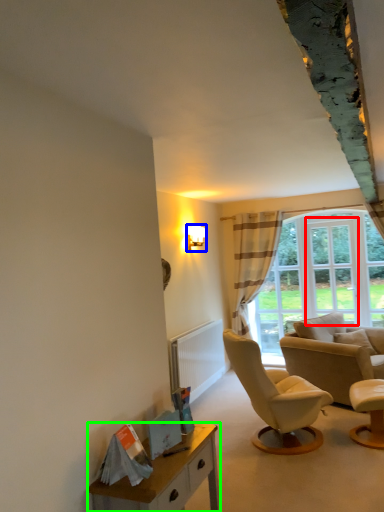
Question: Estimate the real-world distances between objects in this image. Which object is farther from window frame (highlighted by a red box), lamp (highlighted by a blue box) or desk (highlighted by a green box)?

Choices:
 (A) lamp
 (B) desk

Answer: (B)